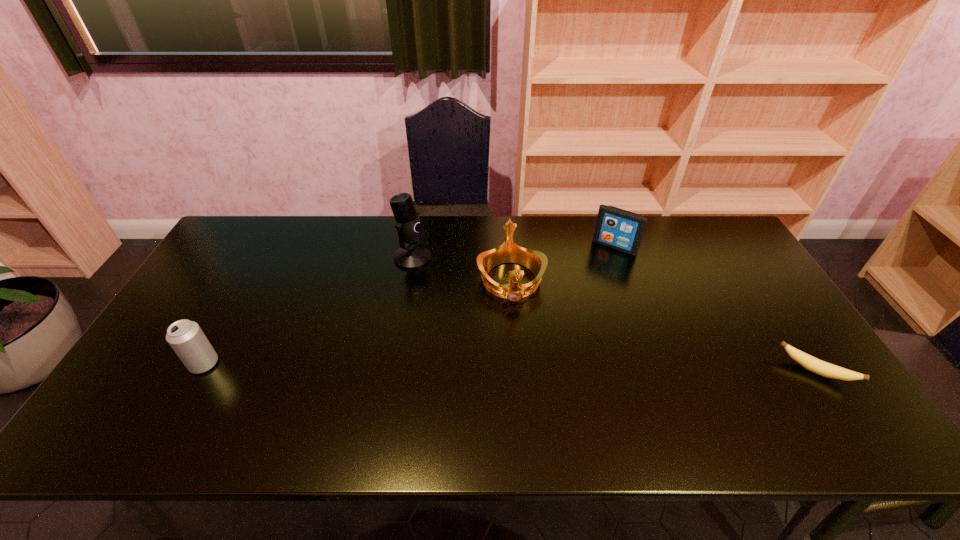
Locate an element on the screen. This screenshot has height=540, width=960. free space that is in between the fourth object from left to right and the beer can is located at coordinates (409, 305).

The image size is (960, 540). Find the location of `free area in between the rightmost object and the beer can`. free area in between the rightmost object and the beer can is located at coordinates point(509,367).

This screenshot has height=540, width=960. I want to click on unoccupied position between the third object from right to left and the second object from left to right, so click(x=462, y=269).

Locate an element on the screen. vacant point located between the iPod and the rightmost object is located at coordinates tap(714, 309).

This screenshot has width=960, height=540. Identify the location of free space that is in between the banana and the beer can. (509, 367).

Locate an element on the screen. Image resolution: width=960 pixels, height=540 pixels. free spot between the second object from right to left and the rightmost object is located at coordinates (714, 309).

Where is `free space between the second object from right to left and the shortest object`? free space between the second object from right to left and the shortest object is located at coordinates (714, 309).

The width and height of the screenshot is (960, 540). What are the coordinates of `unoccupied area between the microphone and the third object from right to left` in the screenshot? It's located at (462, 269).

What are the coordinates of `unoccupied area between the banana and the fourth object from right to left` in the screenshot? It's located at (613, 314).

Where is `free space between the banana and the tallest object`? Image resolution: width=960 pixels, height=540 pixels. free space between the banana and the tallest object is located at coordinates (613, 314).